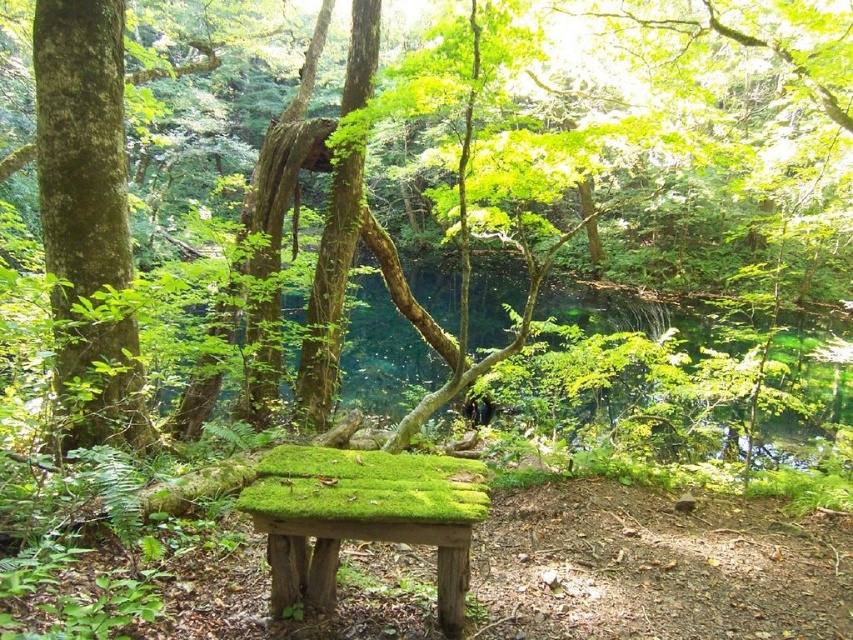
Which is more to the right, green mossy bench at center or green mossy tree at left?

Positioned to the right is green mossy bench at center.

Between point (555, 216) and point (115, 280), which one is positioned in front?

Positioned in front is point (115, 280).

Where is `green mossy bench at center`? Image resolution: width=853 pixels, height=640 pixels. green mossy bench at center is located at coordinates (613, 173).

Can you confirm if green mossy bench at center is positioned to the right of green mossy wood bench at center?

Indeed, green mossy bench at center is positioned on the right side of green mossy wood bench at center.

Is green mossy bench at center to the left of green mossy wood bench at center from the viewer's perspective?

In fact, green mossy bench at center is to the right of green mossy wood bench at center.

Does point (50, 208) come in front of point (337, 522)?

No, (50, 208) is behind (337, 522).

Image resolution: width=853 pixels, height=640 pixels. Find the location of `green mossy bench at center`. green mossy bench at center is located at coordinates (613, 173).

Is green mossy tree at left wider than green mossy wood bench at center?

Yes, green mossy tree at left is wider than green mossy wood bench at center.

Does green mossy tree at left have a greater height compared to green mossy wood bench at center?

Yes, green mossy tree at left is taller than green mossy wood bench at center.

Locate an element on the screen. The height and width of the screenshot is (640, 853). green mossy tree at left is located at coordinates (86, 209).